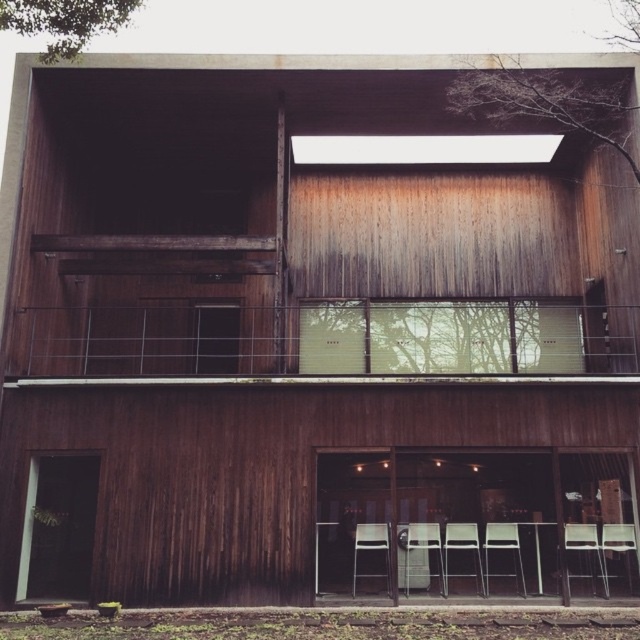
Is metallic silver chair at center wider than metallic silver chair at lower right?

Indeed, metallic silver chair at center has a greater width compared to metallic silver chair at lower right.

Does metallic silver chair at center come behind metallic silver chair at lower right?

No, metallic silver chair at center is closer to the viewer.

Where is `metallic silver chair at center`? The height and width of the screenshot is (640, 640). metallic silver chair at center is located at coordinates (422, 547).

Identify the location of metallic silver chair at center. Image resolution: width=640 pixels, height=640 pixels. (422, 547).

Is metallic silver chair at center further to camera compared to matte wood chair at lower right?

That is True.

Does point (426, 532) come behind point (579, 538)?

Yes, point (426, 532) is farther from viewer.

Locate an element on the screen. The image size is (640, 640). metallic silver chair at center is located at coordinates tap(422, 547).

Does point (369, 576) lie behind point (576, 548)?

Yes, it is.

Does white plastic chair at lower center have a greater height compared to matte wood chair at lower right?

Indeed, white plastic chair at lower center has a greater height compared to matte wood chair at lower right.

Locate an element on the screen. The image size is (640, 640). white plastic chair at lower center is located at coordinates (371, 548).